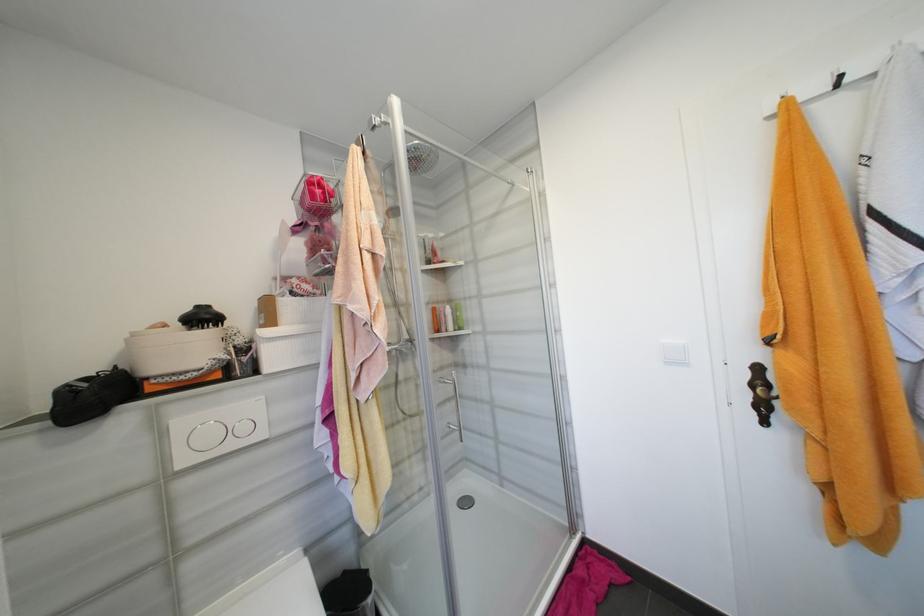
At what (x,y) coordinates should I click in order to perform the action: click on small flush button. Please return your answer as a coordinate pair (x, y). The image size is (924, 616). Looking at the image, I should click on (244, 428).